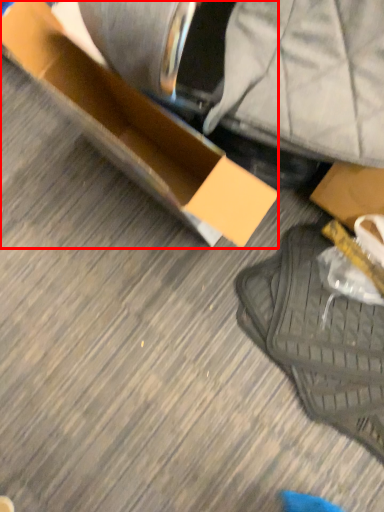
Question: From the image's perspective, what is the correct spatial positioning of box (annotated by the red box) in reference to footwear?

Choices:
 (A) above
 (B) below

Answer: (A)